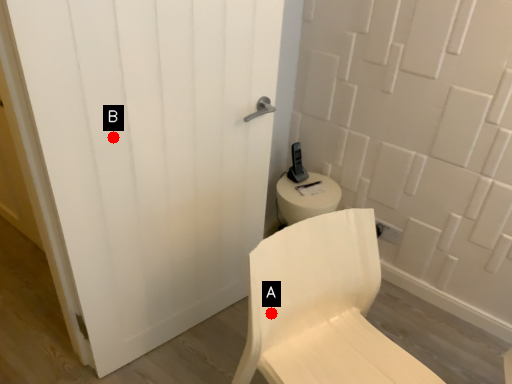
Question: Two points are circled on the image, labeled by A and B beside each circle. Which point is closer to the camera?

Choices:
 (A) A is closer
 (B) B is closer

Answer: (B)